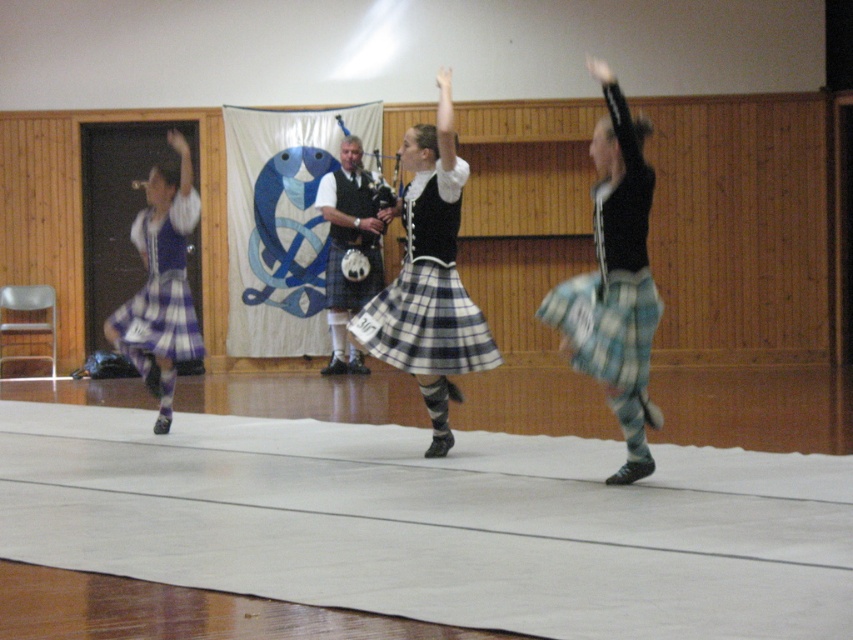
Question: Which is farther from the plaid skirt at center?

Choices:
 (A) blue plaid skirt at left
 (B) black plaid skirt at center

Answer: (A)

Question: Can you confirm if black plaid skirt at center is positioned below blue plaid skirt at left?

Choices:
 (A) no
 (B) yes

Answer: (A)

Question: Does black plaid skirt at center come in front of blue plaid skirt at left?

Choices:
 (A) no
 (B) yes

Answer: (B)

Question: Among these points, which one is farthest from the camera?

Choices:
 (A) (149, 289)
 (B) (610, 358)
 (C) (450, 170)

Answer: (A)

Question: Which object appears closest to the camera in this image?

Choices:
 (A) plaid skirt at center
 (B) black plaid skirt at center

Answer: (A)

Question: Is black plaid skirt at center smaller than blue plaid skirt at left?

Choices:
 (A) no
 (B) yes

Answer: (A)